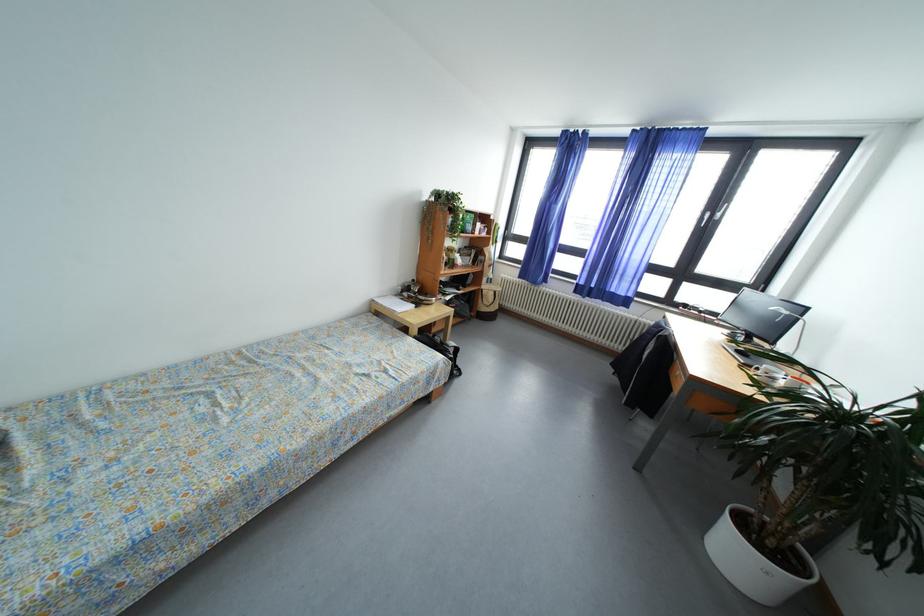
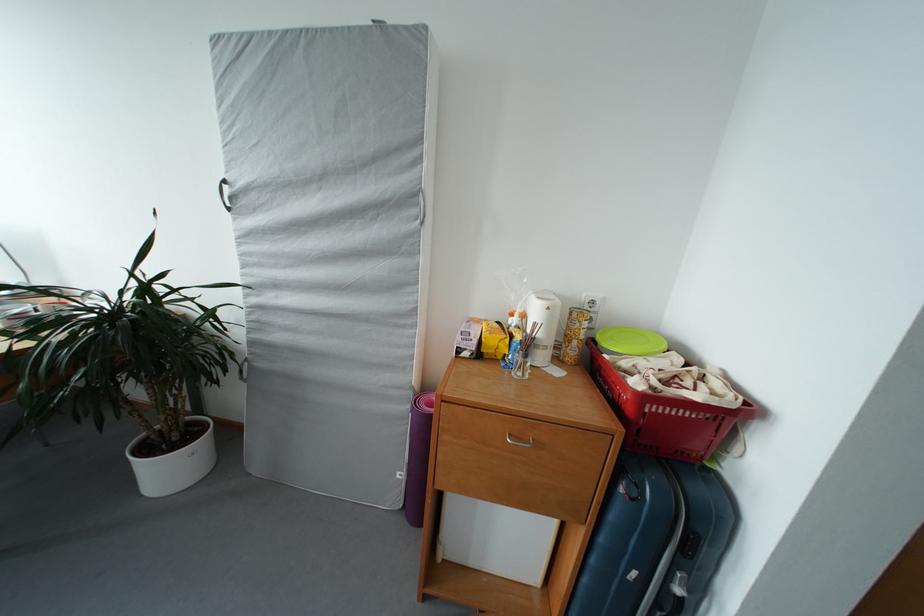
Consider the image. First-person continuous shooting, in which direction is the camera rotating?

The camera's rotation is toward right-down.